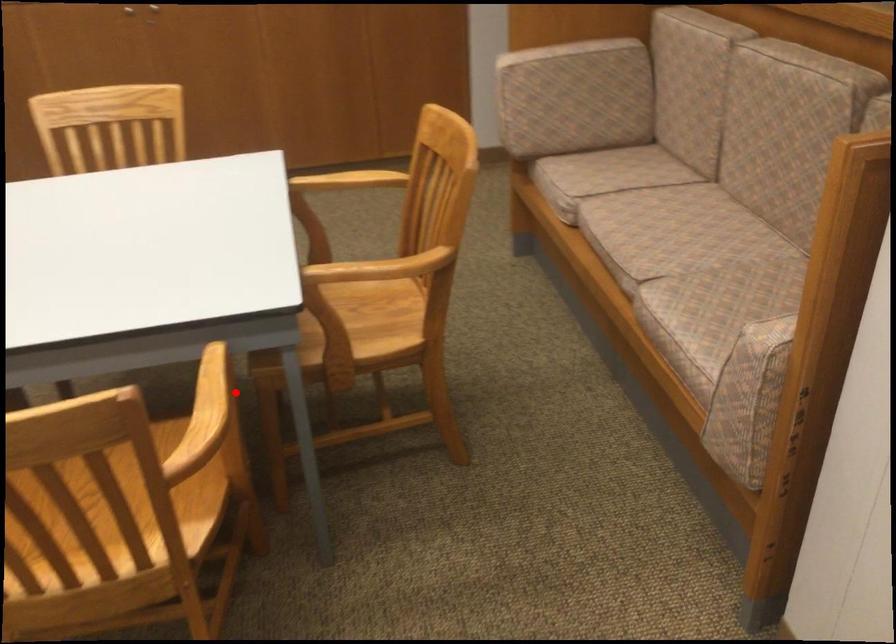
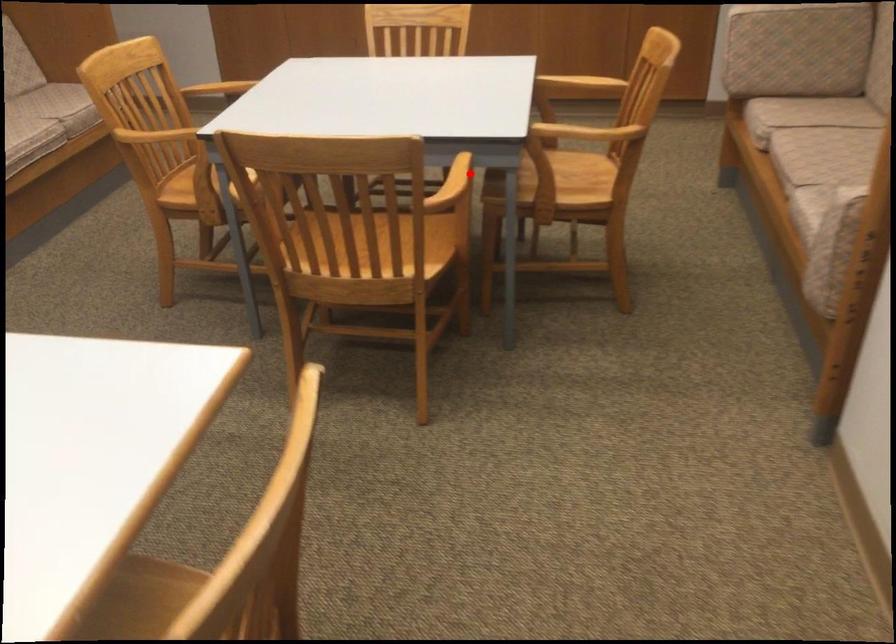
I am providing you with two images of the same scene from different viewpoints. A red point is marked on the first image and another point is marked on the second image. Is the marked point in image1 the same physical position as the marked point in image2?

Yes